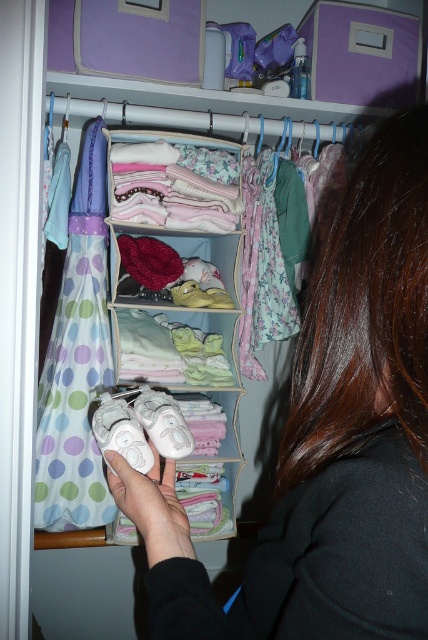
Question: Is white matte baby shoes at center to the right of white suede shoe at center from the viewer's perspective?

Choices:
 (A) yes
 (B) no

Answer: (B)

Question: Among these points, which one is nearest to the camera?

Choices:
 (A) (143, 512)
 (B) (77, 408)
 (C) (113, 394)

Answer: (A)

Question: Where is white fabric baby shoes at center located in relation to white suede shoe at center in the image?

Choices:
 (A) left
 (B) right

Answer: (A)

Question: Observing the image, what is the correct spatial positioning of white fabric baby shoes at center in reference to white suede baby shoes at center?

Choices:
 (A) above
 (B) below

Answer: (A)

Question: Which point is farther to the camera?

Choices:
 (A) polka dot fabric dress at left
 (B) white suede baby shoes at center

Answer: (A)

Question: Which is farther from the white fabric baby shoes at center?

Choices:
 (A) polka dot fabric dress at left
 (B) white suede shoe at center
 (C) white soft baby shoes at center
 (D) white suede baby shoes at center

Answer: (C)